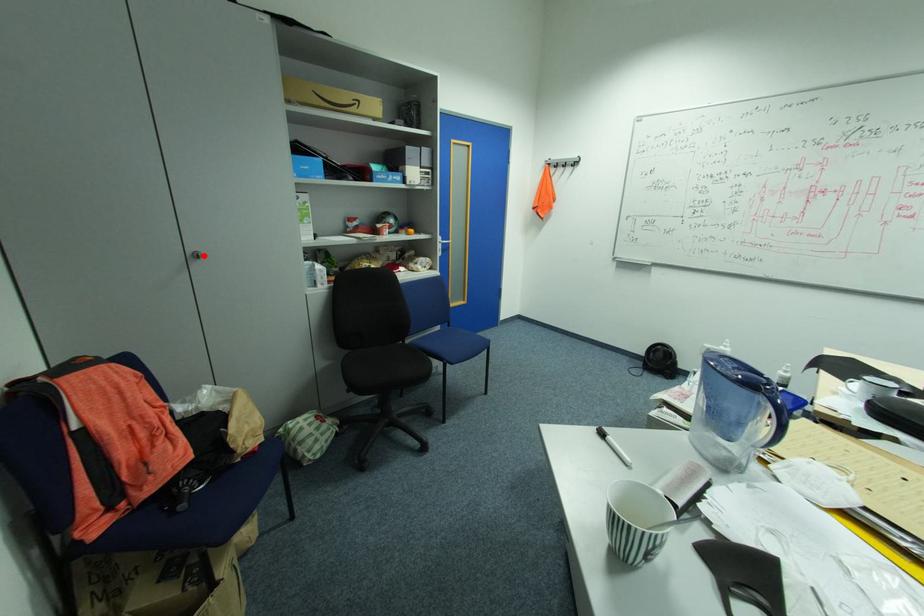
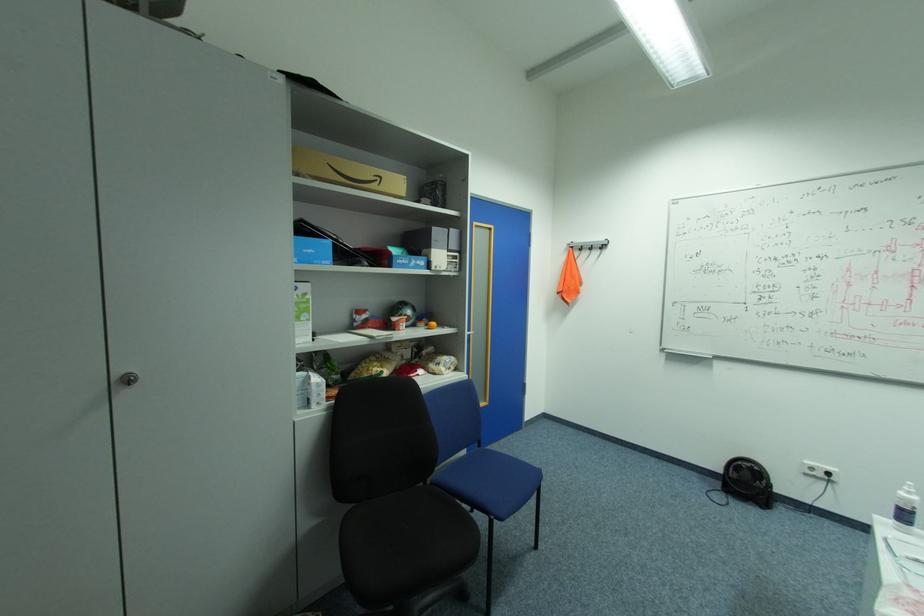
Where in the second image is the point corresponding to the highlighted location from the first image?

(137, 379)